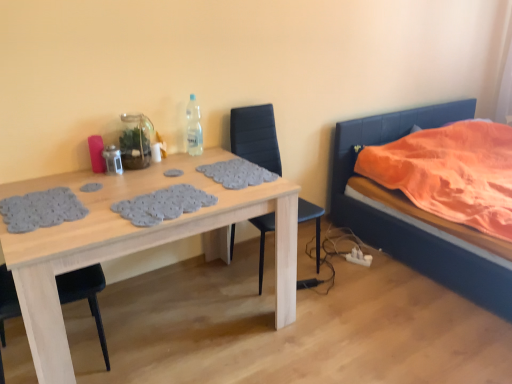
Question: From the image's perspective, would you say wooden table at center is positioned over clear plastic bottle at upper center?

Choices:
 (A) no
 (B) yes

Answer: (A)

Question: Can you confirm if wooden table at center is taller than clear plastic bottle at upper center?

Choices:
 (A) no
 (B) yes

Answer: (B)

Question: Does wooden table at center come behind clear plastic bottle at upper center?

Choices:
 (A) yes
 (B) no

Answer: (B)

Question: Does wooden table at center appear on the left side of clear plastic bottle at upper center?

Choices:
 (A) no
 (B) yes

Answer: (B)

Question: Is wooden table at center facing towards clear plastic bottle at upper center?

Choices:
 (A) no
 (B) yes

Answer: (A)

Question: Is wooden table at center far away from clear plastic bottle at upper center?

Choices:
 (A) no
 (B) yes

Answer: (A)

Question: Is black leather chair at center a part of clear plastic bottle at upper center?

Choices:
 (A) yes
 (B) no

Answer: (B)

Question: Does clear plastic bottle at upper center come in front of black leather chair at center?

Choices:
 (A) no
 (B) yes

Answer: (A)

Question: Does clear plastic bottle at upper center have a larger size compared to black leather chair at center?

Choices:
 (A) yes
 (B) no

Answer: (B)

Question: Does clear plastic bottle at upper center have a greater width compared to black leather chair at center?

Choices:
 (A) no
 (B) yes

Answer: (A)

Question: Would you say clear plastic bottle at upper center is a long distance from black leather chair at center?

Choices:
 (A) yes
 (B) no

Answer: (B)

Question: Is clear plastic bottle at upper center touching black leather chair at center?

Choices:
 (A) yes
 (B) no

Answer: (B)

Question: Can you confirm if wooden table at center is shorter than black leather chair at center?

Choices:
 (A) yes
 (B) no

Answer: (A)